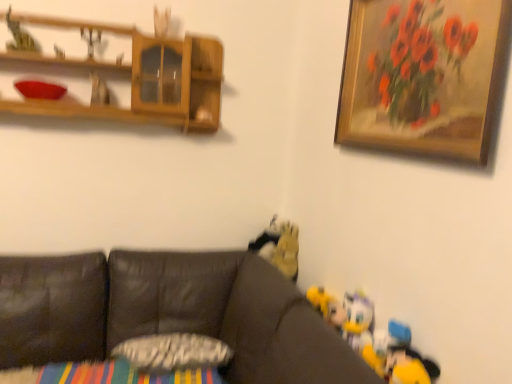
Question: From the image's perspective, would you say wooden framed painting at upper right is shown under yellow plush toy at lower right, which is counted as the 6th toy, starting from the left?

Choices:
 (A) no
 (B) yes

Answer: (A)

Question: Is wooden framed painting at upper right turned away from yellow plush toy at lower right, the first toy viewed from the front?

Choices:
 (A) no
 (B) yes

Answer: (A)

Question: Does wooden framed painting at upper right have a lesser width compared to yellow plush toy at lower right, which is counted as the 6th toy, starting from the left?

Choices:
 (A) no
 (B) yes

Answer: (B)

Question: Can you confirm if wooden framed painting at upper right is shorter than yellow plush toy at lower right, the 6th toy positioned from the top?

Choices:
 (A) no
 (B) yes

Answer: (A)

Question: Does wooden framed painting at upper right appear on the right side of yellow plush toy at lower right, marked as the sixth toy in a back-to-front arrangement?

Choices:
 (A) yes
 (B) no

Answer: (A)

Question: Looking at their shapes, would you say fluffy yellow toy at center, which is counted as the 6th toy, starting from the front, is wider or thinner than textured gray pillow at center?

Choices:
 (A) thin
 (B) wide

Answer: (A)

Question: Is fluffy yellow toy at center, the third toy from the bottom, inside or outside of textured gray pillow at center?

Choices:
 (A) inside
 (B) outside

Answer: (B)

Question: Based on their positions, is fluffy yellow toy at center, the third toy positioned from the right, located to the left or right of textured gray pillow at center?

Choices:
 (A) left
 (B) right

Answer: (B)

Question: Is point (266, 236) positioned closer to the camera than point (194, 364)?

Choices:
 (A) farther
 (B) closer

Answer: (A)

Question: From a real-world perspective, relative to brown leather couch at lower left, is metallic silver toy at upper left, the 3th toy in the top-to-bottom sequence, vertically above or below?

Choices:
 (A) above
 (B) below

Answer: (A)

Question: Does point (99, 86) appear closer or farther from the camera than point (227, 268)?

Choices:
 (A) closer
 (B) farther

Answer: (A)

Question: In terms of height, does metallic silver toy at upper left, the 3th toy from the left, look taller or shorter compared to brown leather couch at lower left?

Choices:
 (A) tall
 (B) short

Answer: (B)

Question: From the image's perspective, relative to brown leather couch at lower left, is metallic silver toy at upper left, the 3th toy in the top-to-bottom sequence, above or below?

Choices:
 (A) above
 (B) below

Answer: (A)

Question: From the image's perspective, is wooden framed painting at upper right positioned above or below matte plastic toy at upper left, placed as the 5th toy when sorted from right to left?

Choices:
 (A) below
 (B) above

Answer: (A)

Question: Is point (505, 29) closer or farther from the camera than point (90, 34)?

Choices:
 (A) farther
 (B) closer

Answer: (B)